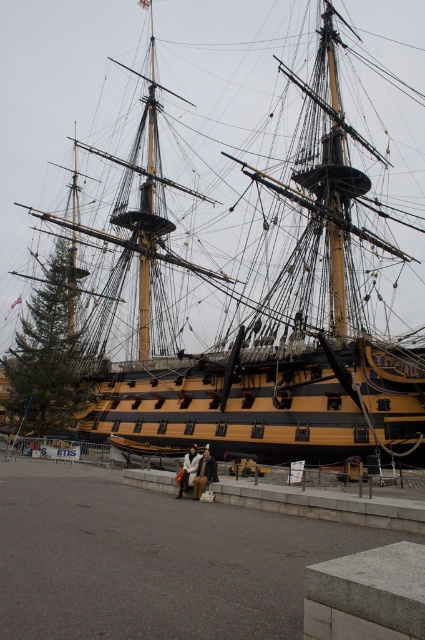
Question: Considering the relative positions of yellow polished wood ship at center and white wool coat at center in the image provided, where is yellow polished wood ship at center located with respect to white wool coat at center?

Choices:
 (A) left
 (B) right

Answer: (B)

Question: Observing the image, what is the correct spatial positioning of yellow polished wood ship at center in reference to white wool coat at center?

Choices:
 (A) above
 (B) below

Answer: (A)

Question: Which object is farther from the camera taking this photo?

Choices:
 (A) brown leather jacket at center
 (B) yellow polished wood ship at center
 (C) white wool coat at center

Answer: (C)

Question: Which object is positioned closest to the white wool coat at center?

Choices:
 (A) brown leather jacket at center
 (B) yellow polished wood ship at center

Answer: (A)

Question: From the image, what is the correct spatial relationship of yellow polished wood ship at center in relation to white wool coat at center?

Choices:
 (A) right
 (B) left

Answer: (A)

Question: Which object is the farthest from the white wool coat at center?

Choices:
 (A) brown leather jacket at center
 (B) yellow polished wood ship at center

Answer: (B)